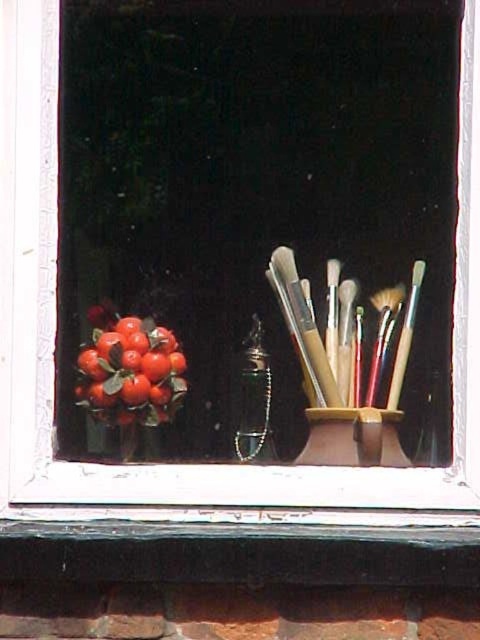
Does shiny red berries at left appear on the left side of matte black brush at center right?

Yes, shiny red berries at left is to the left of matte black brush at center right.

Does shiny red berries at left have a lesser height compared to matte black brush at center right?

In fact, shiny red berries at left may be taller than matte black brush at center right.

Which is behind, point (169, 346) or point (370, 401)?

The point (370, 401) is behind.

In order to click on shiny red berries at left in this screenshot , I will do `click(130, 369)`.